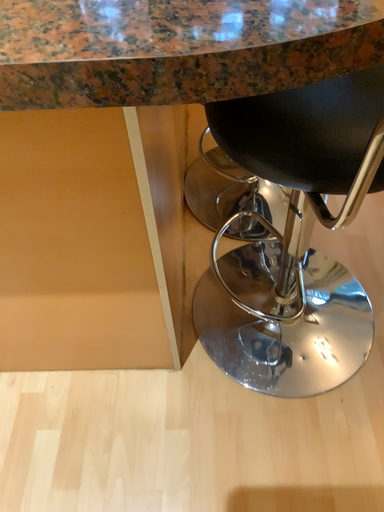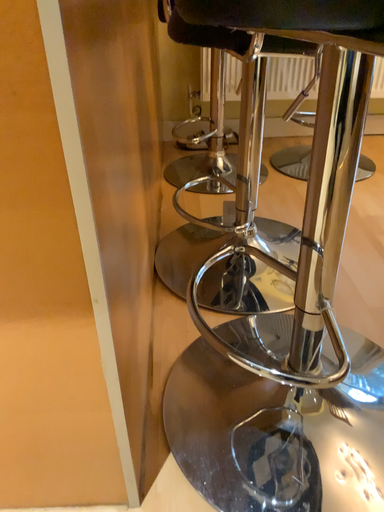
Question: Which way did the camera rotate in the video?

Choices:
 (A) rotated downward
 (B) rotated upward

Answer: (B)